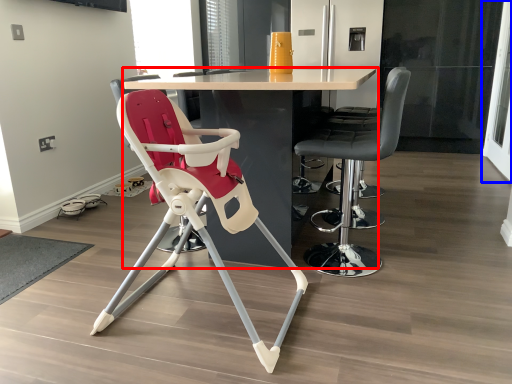
Question: Which object appears closest to the camera in this image, table (highlighted by a red box) or screen door (highlighted by a blue box)?

Choices:
 (A) table
 (B) screen door

Answer: (A)